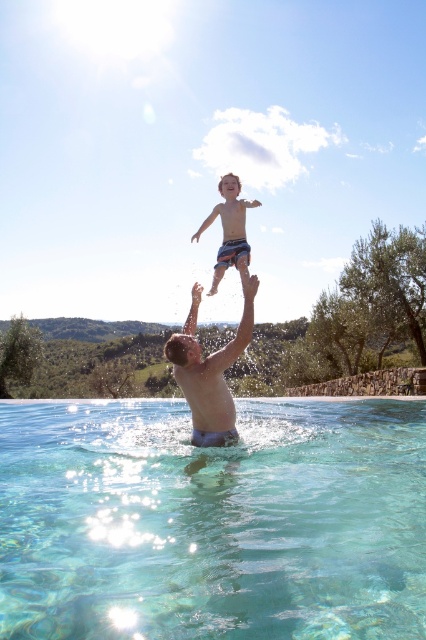
Which is above, smooth skin man at center or blue striped shorts at upper center?

blue striped shorts at upper center

From the picture: Can you confirm if smooth skin man at center is positioned to the left of blue striped shorts at upper center?

Correct, you'll find smooth skin man at center to the left of blue striped shorts at upper center.

Who is more forward, (181, 333) or (222, 248)?

Positioned in front is point (181, 333).

What are the coordinates of `smooth skin man at center` in the screenshot? It's located at (210, 371).

Does clear glass water at lower center appear on the left side of blue striped shorts at upper center?

Incorrect, clear glass water at lower center is not on the left side of blue striped shorts at upper center.

Image resolution: width=426 pixels, height=640 pixels. Describe the element at coordinates (213, 522) in the screenshot. I see `clear glass water at lower center` at that location.

This screenshot has height=640, width=426. What are the coordinates of `clear glass water at lower center` in the screenshot? It's located at (213, 522).

Who is positioned more to the left, clear glass water at lower center or smooth skin man at center?

Positioned to the left is smooth skin man at center.

Does clear glass water at lower center have a lesser width compared to smooth skin man at center?

Incorrect, clear glass water at lower center's width is not less than smooth skin man at center's.

Image resolution: width=426 pixels, height=640 pixels. In order to click on clear glass water at lower center in this screenshot , I will do `click(213, 522)`.